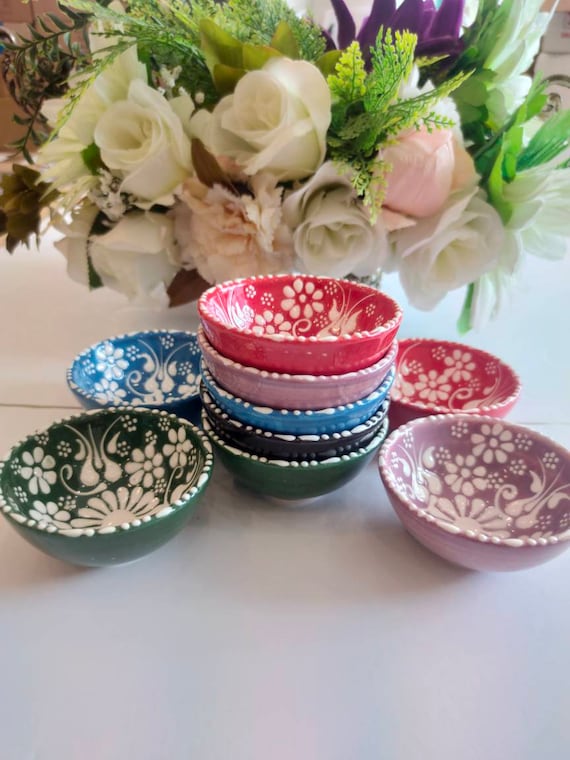
Locate an element on the screen. This screenshot has width=570, height=760. bowls is located at coordinates (170, 365), (123, 498), (428, 387), (467, 492), (299, 492), (290, 451), (309, 419), (301, 397), (304, 350).